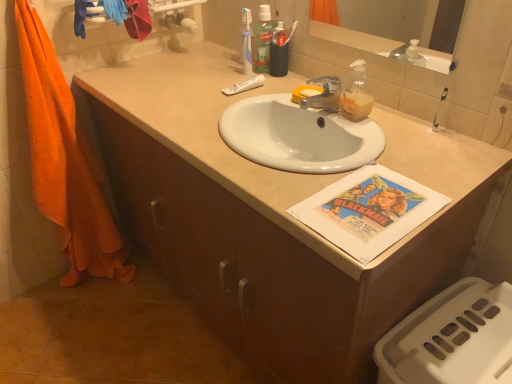
Question: Is white matte tube at center taller than orange cotton towel at left?

Choices:
 (A) yes
 (B) no

Answer: (B)

Question: From a real-world perspective, is white matte tube at center located higher than orange cotton towel at left?

Choices:
 (A) no
 (B) yes

Answer: (B)

Question: Is white matte tube at center positioned beyond the bounds of orange cotton towel at left?

Choices:
 (A) no
 (B) yes

Answer: (B)

Question: Does white matte tube at center have a lesser width compared to orange cotton towel at left?

Choices:
 (A) no
 (B) yes

Answer: (B)

Question: Can orange cotton towel at left be found inside white matte tube at center?

Choices:
 (A) no
 (B) yes

Answer: (A)

Question: Is white matte tube at center aimed at orange cotton towel at left?

Choices:
 (A) yes
 (B) no

Answer: (B)

Question: From the image's perspective, is orange cotton towel at left located beneath white matte tube at center?

Choices:
 (A) yes
 (B) no

Answer: (A)

Question: Considering the relative sizes of orange cotton towel at left and white matte tube at center in the image provided, is orange cotton towel at left thinner than white matte tube at center?

Choices:
 (A) no
 (B) yes

Answer: (A)

Question: Is orange cotton towel at left oriented away from white matte tube at center?

Choices:
 (A) yes
 (B) no

Answer: (B)

Question: From the image's perspective, is orange cotton towel at left over white matte tube at center?

Choices:
 (A) yes
 (B) no

Answer: (B)

Question: Does orange cotton towel at left appear on the left side of white matte tube at center?

Choices:
 (A) no
 (B) yes

Answer: (B)

Question: From a real-world perspective, is orange cotton towel at left physically below white matte tube at center?

Choices:
 (A) no
 (B) yes

Answer: (B)

Question: Could orange cotton towel at left be considered to be inside silver metallic faucet at center?

Choices:
 (A) no
 (B) yes

Answer: (A)